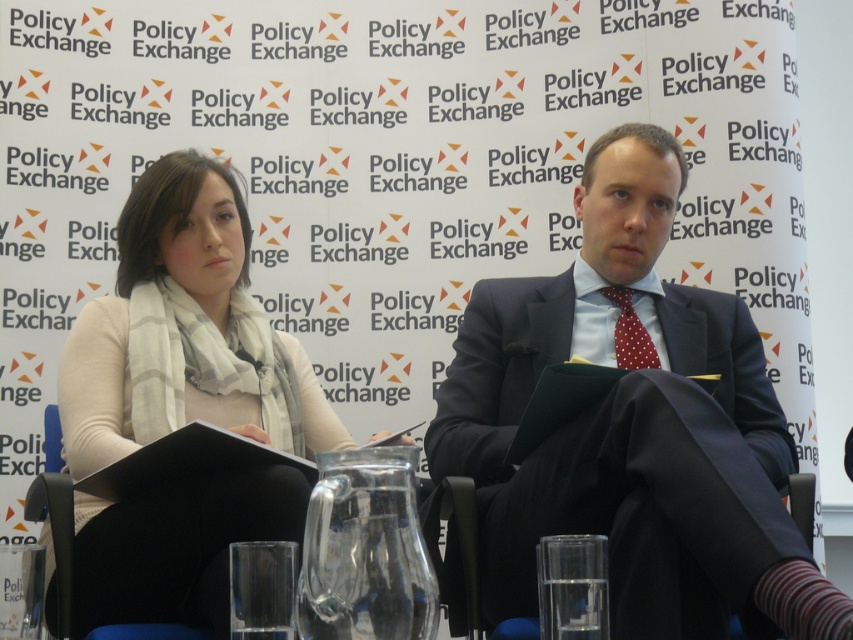
You are a photographer at the event and need to adjust the lighting so that the matte black suit at center and the polka dot silk tie at center are both well illuminated. Which object requires more light to appear properly exposed in the photo?

The matte black suit at center requires more light because black absorbs more light and needs additional illumination to appear properly exposed compared to the polka dot silk tie at center, which likely reflects more light.

You are a photographer at the Policy Exchange event. You need to ensure that both the white wool scarf at center and the polka dot silk tie at center are visible in your portrait. Given their sizes, which one will require more space in the frame?

The white wool scarf at center is bigger than the polka dot silk tie at center, so it will require more space in the frame to ensure visibility.